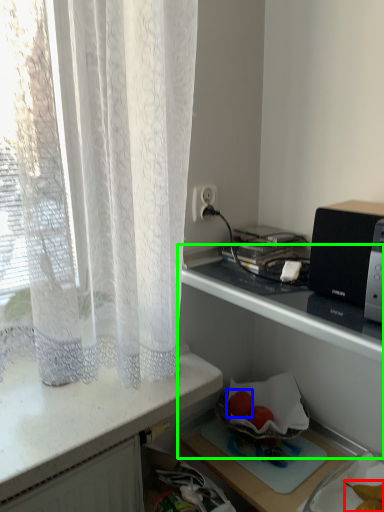
Question: Which object is positioned closest to food (highlighted by a red box)? Select from fruit (highlighted by a blue box) and shelf (highlighted by a green box).

Choices:
 (A) fruit
 (B) shelf

Answer: (A)